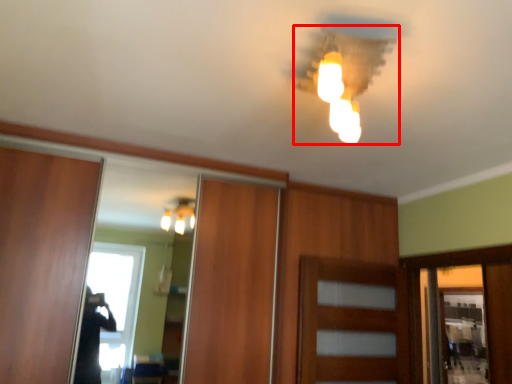
Question: Observing the image, what is the correct spatial positioning of lamp (annotated by the red box) in reference to door?

Choices:
 (A) left
 (B) right

Answer: (A)